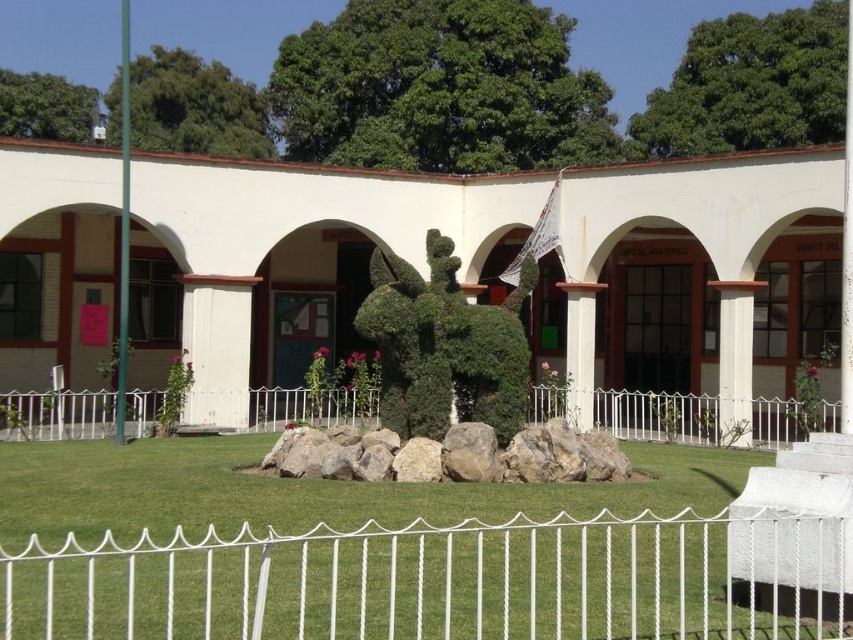
Find the location of a particular element. white wire fence at lower center is located at coordinates (444, 580).

Who is positioned more to the right, white wire fence at lower center or green leafy hedge at center?

Positioned to the right is green leafy hedge at center.

Describe the element at coordinates (444, 580) in the screenshot. I see `white wire fence at lower center` at that location.

Image resolution: width=853 pixels, height=640 pixels. Find the location of `white wire fence at lower center`. white wire fence at lower center is located at coordinates [x=444, y=580].

Which of these two, green leafy hedge at center or gray rock at center, stands shorter?

gray rock at center is shorter.

Is green leafy hedge at center to the right of gray rock at center from the viewer's perspective?

Indeed, green leafy hedge at center is positioned on the right side of gray rock at center.

Between point (387, 273) and point (612, 464), which one is positioned in front?

Point (612, 464) is in front.

Where is `green leafy hedge at center`? The image size is (853, 640). green leafy hedge at center is located at coordinates (444, 346).

Can you confirm if white metal fence at center is positioned to the right of green leafy hedge at center?

Incorrect, white metal fence at center is not on the right side of green leafy hedge at center.

Who is lower down, white metal fence at center or green leafy hedge at center?

Positioned lower is white metal fence at center.

At what (x,y) coordinates should I click in order to perform the action: click on white metal fence at center. Please return your answer as a coordinate pair (x, y). The width and height of the screenshot is (853, 640). Looking at the image, I should click on (708, 419).